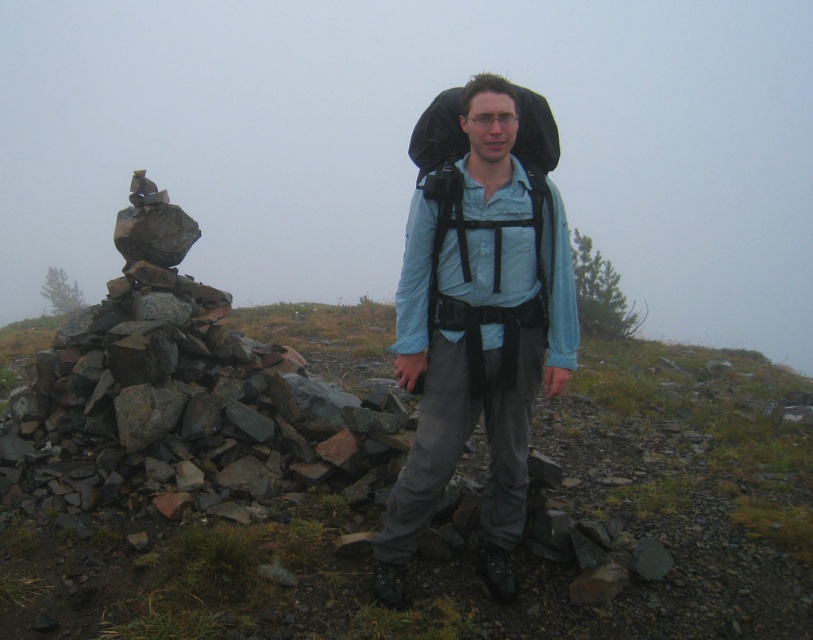
Question: Can you confirm if matte black backpack at center is wider than black fabric backpack at center?

Choices:
 (A) no
 (B) yes

Answer: (A)

Question: Is the position of matte black backpack at center more distant than that of black fabric backpack at center?

Choices:
 (A) no
 (B) yes

Answer: (A)

Question: Which point is closer to the camera taking this photo?

Choices:
 (A) (483, 300)
 (B) (553, 128)

Answer: (A)

Question: Among these objects, which one is farthest from the camera?

Choices:
 (A) black fabric backpack at center
 (B) matte black backpack at center

Answer: (A)

Question: Where is matte black backpack at center located in relation to black fabric backpack at center in the image?

Choices:
 (A) right
 (B) left

Answer: (B)